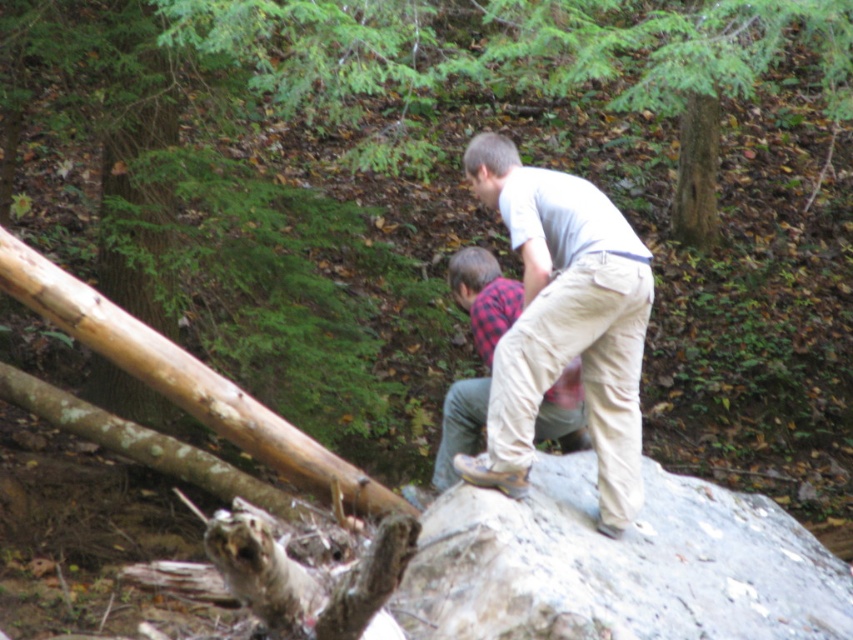
Measure the distance between point (630, 618) and camera.

4.71 meters

Is gray rough rock at center below plaid fabric shirt at center?

Yes, gray rough rock at center is below plaid fabric shirt at center.

Consider the image. Who is more forward, (505, 525) or (466, 291)?

Point (505, 525)

Find the location of a particular element. This screenshot has width=853, height=640. gray rough rock at center is located at coordinates click(618, 564).

Is gray rough rock at center below light beige cotton pants at center?

Correct, gray rough rock at center is located below light beige cotton pants at center.

You are a GUI agent. You are given a task and a screenshot of the screen. Output one action in this format:
    pyautogui.click(x=<x>, y=<y>)
    Task: Click on the gray rough rock at center
    This screenshot has height=640, width=853.
    Given the screenshot: What is the action you would take?
    pyautogui.click(x=618, y=564)

Is light beige cotton pants at center further to the viewer compared to plaid fabric shirt at center?

No.

Describe the element at coordinates (564, 323) in the screenshot. I see `light beige cotton pants at center` at that location.

Where is `light beige cotton pants at center`? This screenshot has width=853, height=640. light beige cotton pants at center is located at coordinates (564, 323).

Identify the location of light beige cotton pants at center. (564, 323).